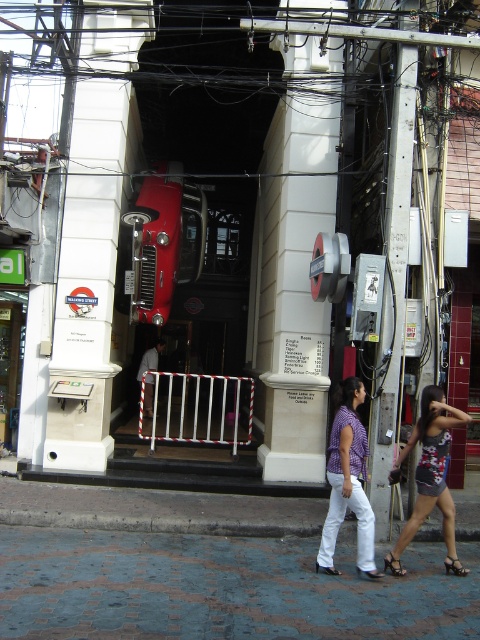
What is the spatial relationship between the white concrete pillar at center and the black leather sandal at lower right in the scene?

The white concrete pillar at center is located to the left of the black leather sandal at lower right.